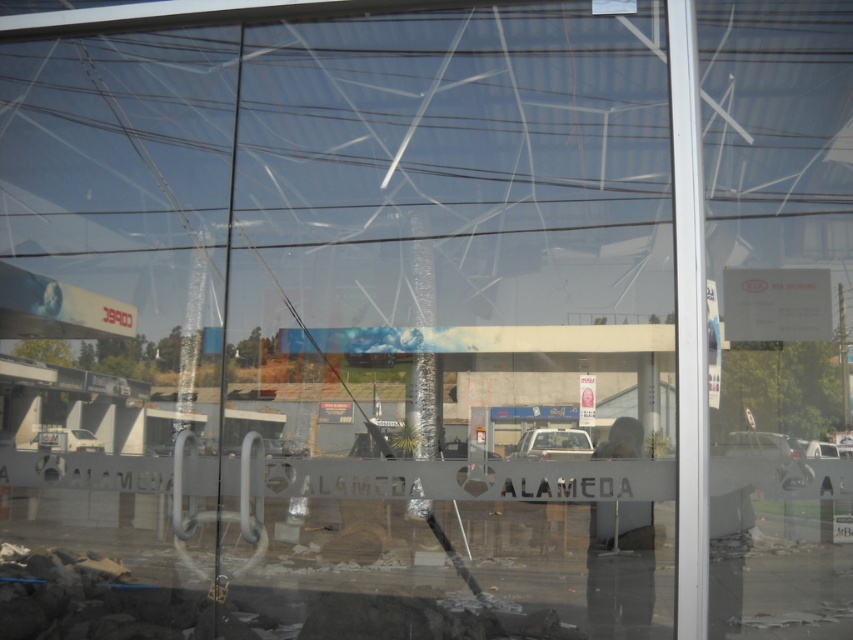
Is white matte car at center wider than white glossy car at lower left?

In fact, white matte car at center might be narrower than white glossy car at lower left.

Can you confirm if white matte car at center is positioned below white glossy car at lower left?

Incorrect, white matte car at center is not positioned below white glossy car at lower left.

Does point (527, 449) come in front of point (41, 445)?

No, (527, 449) is behind (41, 445).

The image size is (853, 640). I want to click on white matte car at center, so click(552, 444).

Is point (798, 445) farther from camera compared to point (828, 451)?

That is False.

Consider the image. Is metallic silver car at lower right in front of white glossy car at center?

That is True.

Find the location of `metallic silver car at lower right`. metallic silver car at lower right is located at coordinates [x=770, y=454].

Can you confirm if metallic silver car at lower right is smaller than white matte car at center?

Yes.

Is metallic silver car at lower right closer to camera compared to white matte car at center?

Yes, metallic silver car at lower right is in front of white matte car at center.

Who is more distant from viewer, (786, 486) or (531, 440)?

The point (531, 440) is behind.

Where is `metallic silver car at lower right`? The height and width of the screenshot is (640, 853). metallic silver car at lower right is located at coordinates (770, 454).